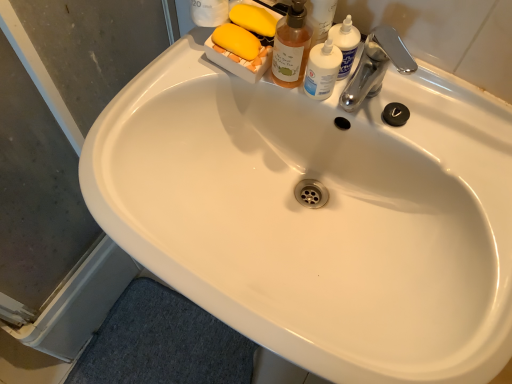
Question: Considering the relative sizes of translucent plastic bottle at upper right and translucent amber bottle at upper right in the image provided, is translucent plastic bottle at upper right shorter than translucent amber bottle at upper right?

Choices:
 (A) no
 (B) yes

Answer: (B)

Question: Does translucent plastic bottle at upper right lie in front of translucent amber bottle at upper right?

Choices:
 (A) yes
 (B) no

Answer: (B)

Question: Does translucent plastic bottle at upper right have a smaller size compared to translucent amber bottle at upper right?

Choices:
 (A) yes
 (B) no

Answer: (A)

Question: Does translucent plastic bottle at upper right turn towards translucent amber bottle at upper right?

Choices:
 (A) yes
 (B) no

Answer: (B)

Question: Would you say translucent plastic bottle at upper right is a long distance from translucent amber bottle at upper right?

Choices:
 (A) no
 (B) yes

Answer: (A)

Question: Considering the relative sizes of translucent plastic bottle at upper right and translucent amber bottle at upper right in the image provided, is translucent plastic bottle at upper right wider than translucent amber bottle at upper right?

Choices:
 (A) no
 (B) yes

Answer: (A)

Question: Does transparent glass screen door at lower left appear on the right side of silver metallic faucet at upper right?

Choices:
 (A) yes
 (B) no

Answer: (B)

Question: From the image's perspective, is transparent glass screen door at lower left above silver metallic faucet at upper right?

Choices:
 (A) yes
 (B) no

Answer: (B)

Question: Are transparent glass screen door at lower left and silver metallic faucet at upper right located far from each other?

Choices:
 (A) yes
 (B) no

Answer: (B)

Question: Considering the relative sizes of transparent glass screen door at lower left and silver metallic faucet at upper right in the image provided, is transparent glass screen door at lower left thinner than silver metallic faucet at upper right?

Choices:
 (A) no
 (B) yes

Answer: (B)

Question: Could you tell me if transparent glass screen door at lower left is facing silver metallic faucet at upper right?

Choices:
 (A) no
 (B) yes

Answer: (B)

Question: Considering the relative sizes of transparent glass screen door at lower left and silver metallic faucet at upper right in the image provided, is transparent glass screen door at lower left smaller than silver metallic faucet at upper right?

Choices:
 (A) yes
 (B) no

Answer: (B)

Question: Is silver metallic faucet at upper right taller than translucent amber bottle at upper right?

Choices:
 (A) no
 (B) yes

Answer: (A)